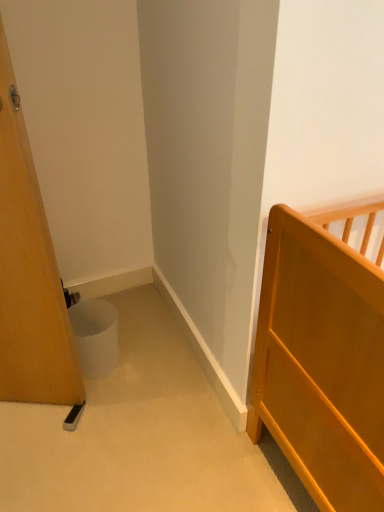
What are the coordinates of `vacant space in front of white matte potty at lower left` in the screenshot? It's located at (91, 397).